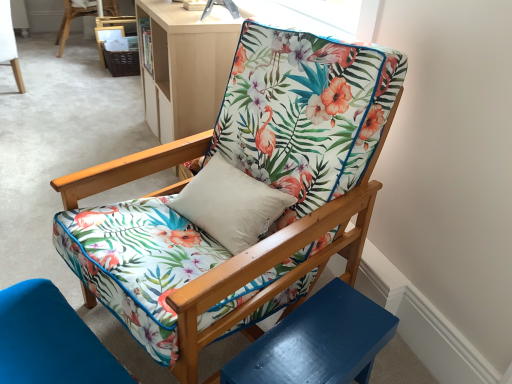
Question: Visually, is glossy blue side table at lower right positioned to the left or to the right of floral fabric chair at upper center, which is the first chair in left-to-right order?

Choices:
 (A) right
 (B) left

Answer: (A)

Question: Looking at the image, does glossy blue side table at lower right seem bigger or smaller compared to floral fabric chair at upper center, arranged as the second chair when viewed from the top?

Choices:
 (A) small
 (B) big

Answer: (A)

Question: Estimate the real-world distances between objects in this image. Which object is closer to the floral fabric chair at center, which is the first chair from front to back?

Choices:
 (A) floral fabric chair at upper center, arranged as the 4th chair when ordered from the bottom
 (B) glossy blue side table at lower right
 (C) floral fabric cushion at lower left, which is the 2th chair in right-to-left order
 (D) matte wood bookshelf at upper center
 (E) floral fabric chair at upper center, the 3th chair from the front

Answer: (B)

Question: Considering the real-world distances, which object is farthest from the floral fabric chair at center, which appears as the 3th chair when viewed from the top?

Choices:
 (A) floral fabric chair at upper center, which appears as the 3th chair when ordered from the bottom
 (B) glossy blue side table at lower right
 (C) matte wood bookshelf at upper center
 (D) floral fabric cushion at lower left, which is the 2th chair in right-to-left order
 (E) floral fabric chair at upper center, which is counted as the third chair, starting from the right

Answer: (E)